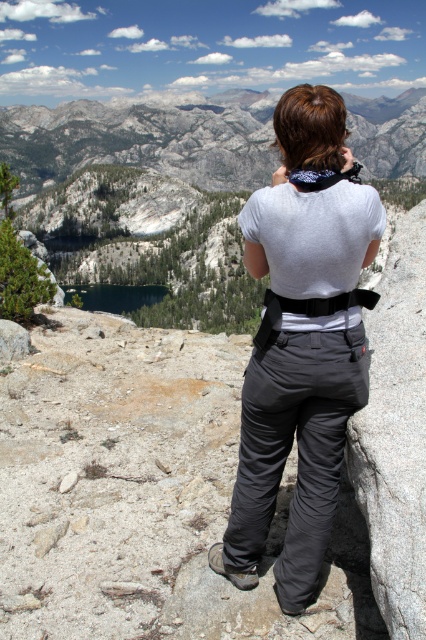
Is gray rock formation at upper center below deep blue water at center?

No.

Is gray rock formation at upper center positioned in front of deep blue water at center?

No, gray rock formation at upper center is further to the viewer.

Does point (416, 120) come behind point (83, 300)?

Yes, point (416, 120) is farther from viewer.

Where is `gray rock formation at upper center`? The width and height of the screenshot is (426, 640). gray rock formation at upper center is located at coordinates (143, 140).

Can you confirm if gray fabric pants at center is positioned to the left of deep blue water at center?

Incorrect, gray fabric pants at center is not on the left side of deep blue water at center.

Is gray fabric pants at center above deep blue water at center?

No.

I want to click on gray fabric pants at center, so click(x=301, y=342).

This screenshot has height=640, width=426. I want to click on gray fabric pants at center, so (301, 342).

Which is more to the right, gray fabric pants at center or gray rock formation at upper center?

gray rock formation at upper center

Does gray fabric pants at center have a greater height compared to gray rock formation at upper center?

No, gray fabric pants at center is not taller than gray rock formation at upper center.

Between point (357, 362) and point (354, 104), which one is positioned in front?

Point (357, 362) is more forward.

Where is `gray fabric pants at center`? gray fabric pants at center is located at coordinates (301, 342).